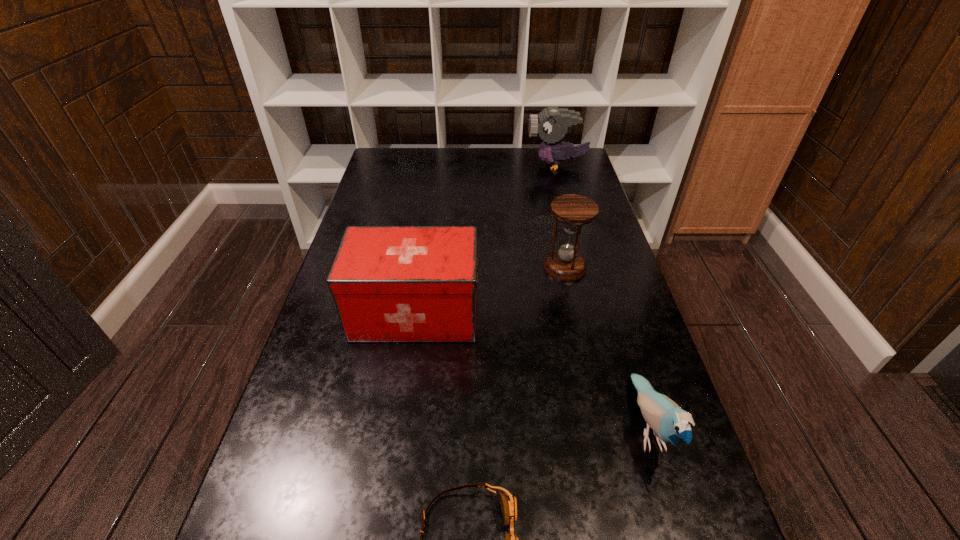
I want to click on object situated at the far edge, so click(x=551, y=124).

This screenshot has width=960, height=540. I want to click on object that is at the left edge, so click(389, 283).

At what (x,y) coordinates should I click in order to perform the action: click on hourglass that is at the right edge. Please return your answer as a coordinate pair (x, y). The width and height of the screenshot is (960, 540). Looking at the image, I should click on (565, 264).

Where is `object that is at the far right corner`? object that is at the far right corner is located at coordinates (551, 124).

In the image, there is a desktop. Where is `free space at the far edge`? This screenshot has width=960, height=540. free space at the far edge is located at coordinates [x=449, y=172].

Where is `vacant area at the left edge of the desktop`? The image size is (960, 540). vacant area at the left edge of the desktop is located at coordinates (313, 340).

Where is `free space at the right edge`? This screenshot has height=540, width=960. free space at the right edge is located at coordinates (618, 258).

Image resolution: width=960 pixels, height=540 pixels. In order to click on vacant area that lies between the second nearest object and the hourglass in this screenshot , I will do `click(607, 347)`.

You are a GUI agent. You are given a task and a screenshot of the screen. Output one action in this format:
    pyautogui.click(x=<x>, y=<y>)
    Task: Click on the free space that is in between the third farthest object and the farthest object
    
    Given the screenshot: What is the action you would take?
    pyautogui.click(x=486, y=239)

This screenshot has width=960, height=540. Find the location of `unoccupied area between the third nearest object and the second farthest object`. unoccupied area between the third nearest object and the second farthest object is located at coordinates pos(491,291).